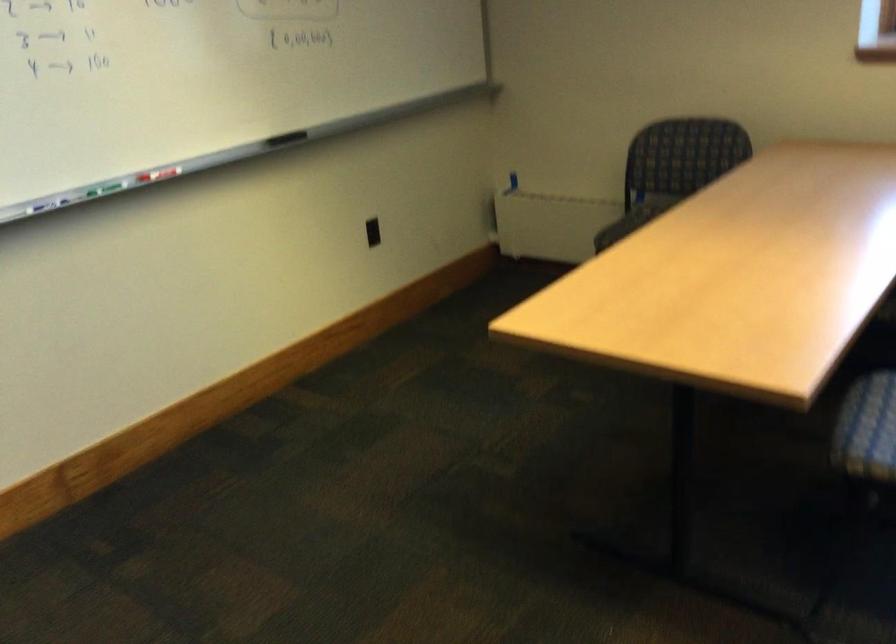
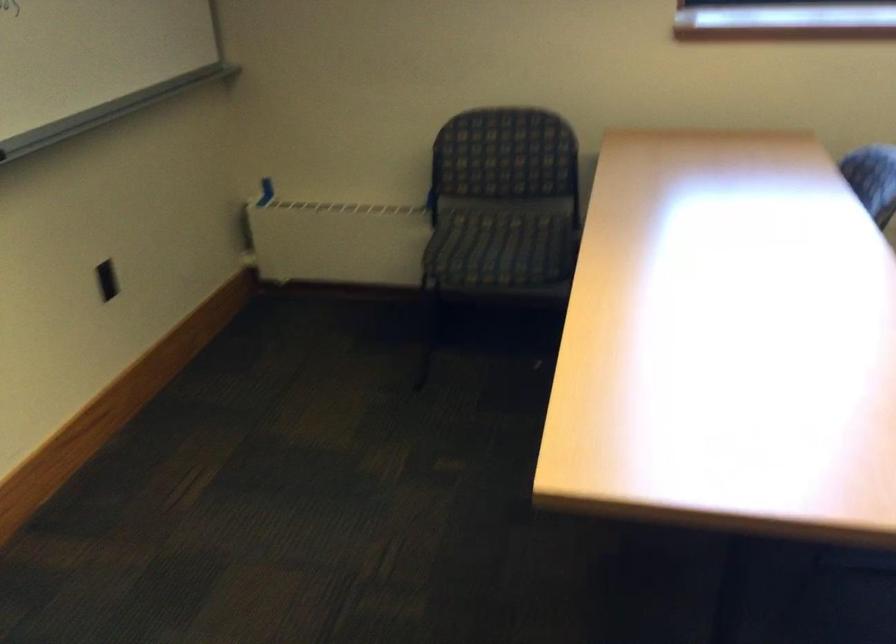
In a continuous first-person perspective shot, in which direction is the camera moving?

The cameraman moved toward left, forward.